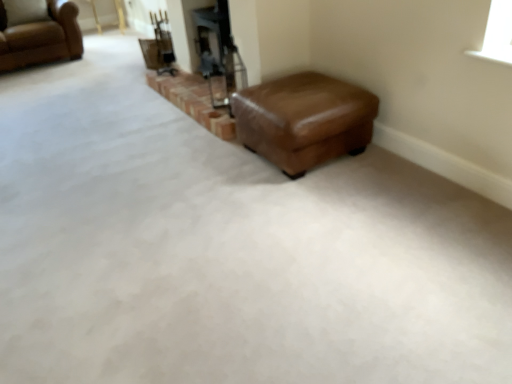
Image resolution: width=512 pixels, height=384 pixels. In order to click on brown leather chair at upper left in this screenshot , I will do `click(42, 38)`.

Measure the distance between brown leather chair at upper left and camera.

brown leather chair at upper left and camera are 14.97 feet apart.

Describe the element at coordinates (42, 38) in the screenshot. Image resolution: width=512 pixels, height=384 pixels. I see `brown leather chair at upper left` at that location.

What is the approximate height of brown leather chair at upper left?

The height of brown leather chair at upper left is 28.22 inches.

Where is `brown leather ottoman at center`? brown leather ottoman at center is located at coordinates click(x=304, y=120).

The width and height of the screenshot is (512, 384). What do you see at coordinates (304, 120) in the screenshot?
I see `brown leather ottoman at center` at bounding box center [304, 120].

This screenshot has width=512, height=384. In order to click on brown leather chair at upper left in this screenshot , I will do `click(42, 38)`.

Can you confirm if brown leather chair at upper left is positioned to the left of brown leather ottoman at center?

Yes, brown leather chair at upper left is to the left of brown leather ottoman at center.

Is the position of brown leather chair at upper left more distant than that of brown leather ottoman at center?

Yes, it is behind brown leather ottoman at center.

Which is farther, (x=70, y=2) or (x=337, y=111)?

Positioned behind is point (x=70, y=2).

From the image's perspective, is brown leather chair at upper left under brown leather ottoman at center?

Actually, brown leather chair at upper left appears above brown leather ottoman at center in the image.

From a real-world perspective, is brown leather chair at upper left physically above brown leather ottoman at center?

Correct, in the physical world, brown leather chair at upper left is higher than brown leather ottoman at center.

Which of these two, brown leather chair at upper left or brown leather ottoman at center, is thinner?

With smaller width is brown leather ottoman at center.

Does brown leather chair at upper left have a lesser height compared to brown leather ottoman at center?

No.

Does brown leather chair at upper left have a larger size compared to brown leather ottoman at center?

Yes, brown leather chair at upper left is bigger than brown leather ottoman at center.

Is brown leather chair at upper left not within brown leather ottoman at center?

Yes.

Is brown leather chair at upper left beside brown leather ottoman at center?

No, brown leather chair at upper left is not next to brown leather ottoman at center.

Is brown leather chair at upper left turned away from brown leather ottoman at center?

No.

What's the angular difference between brown leather chair at upper left and brown leather ottoman at center's facing directions?

The angular difference between brown leather chair at upper left and brown leather ottoman at center is 90 degrees.

Identify the location of stool on the right of brown leather chair at upper left. Image resolution: width=512 pixels, height=384 pixels. (x=304, y=120).

Is brown leather ottoman at center to the right of brown leather chair at upper left from the viewer's perspective?

Yes, brown leather ottoman at center is to the right of brown leather chair at upper left.

Consider the image. Is the depth of brown leather ottoman at center less than that of brown leather chair at upper left?

Yes, the depth of brown leather ottoman at center is less than that of brown leather chair at upper left.

Which point is more forward, (296,135) or (5,44)?

Positioned in front is point (296,135).

Based on the photo, from the image's perspective, is brown leather ottoman at center under brown leather chair at upper left?

Yes.

From a real-world perspective, between brown leather ottoman at center and brown leather chair at upper left, who is vertically lower?

From a 3D spatial view, brown leather ottoman at center is below.

Between brown leather ottoman at center and brown leather chair at upper left, which one has larger width?

Wider between the two is brown leather chair at upper left.

Who is shorter, brown leather ottoman at center or brown leather chair at upper left?

With less height is brown leather ottoman at center.

Considering the sizes of brown leather ottoman at center and brown leather chair at upper left in the image, is brown leather ottoman at center bigger or smaller than brown leather chair at upper left?

brown leather ottoman at center is smaller than brown leather chair at upper left.

Is brown leather ottoman at center located outside brown leather chair at upper left?

Yes, brown leather ottoman at center is located beyond the bounds of brown leather chair at upper left.

Is brown leather ottoman at center positioned far away from brown leather chair at upper left?

That's right, there is a large distance between brown leather ottoman at center and brown leather chair at upper left.

Is brown leather ottoman at center facing towards brown leather chair at upper left?

No, brown leather ottoman at center does not turn towards brown leather chair at upper left.

Can you tell me how much brown leather ottoman at center and brown leather chair at upper left differ in facing direction?

The angle between the facing direction of brown leather ottoman at center and the facing direction of brown leather chair at upper left is 90 degrees.

Where is `stool that is on the right side of brown leather chair at upper left`? stool that is on the right side of brown leather chair at upper left is located at coordinates (304, 120).

Identify the location of stool in front of the brown leather chair at upper left. The image size is (512, 384). (304, 120).

The image size is (512, 384). I want to click on stool on the right of brown leather chair at upper left, so click(x=304, y=120).